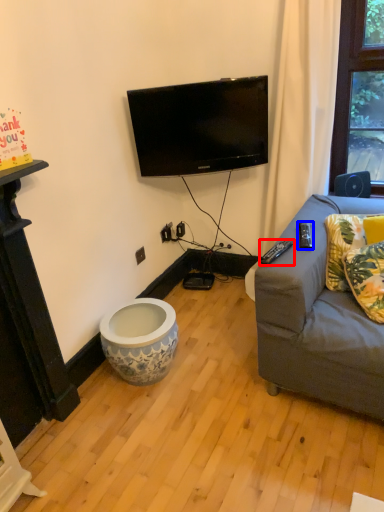
Question: Which point is closer to the camera, remote control (highlighted by a red box) or remote control (highlighted by a blue box)?

Choices:
 (A) remote control
 (B) remote control

Answer: (A)